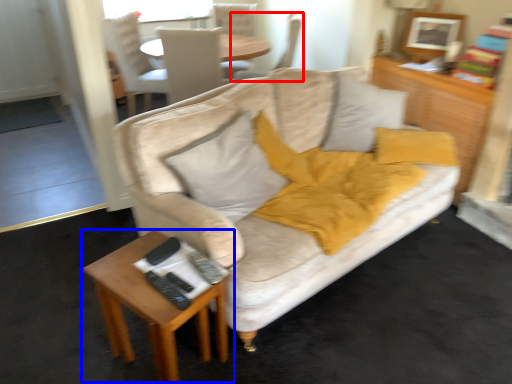
Question: Which of the following is the closest to the observer, chair (highlighted by a red box) or table (highlighted by a blue box)?

Choices:
 (A) chair
 (B) table

Answer: (B)